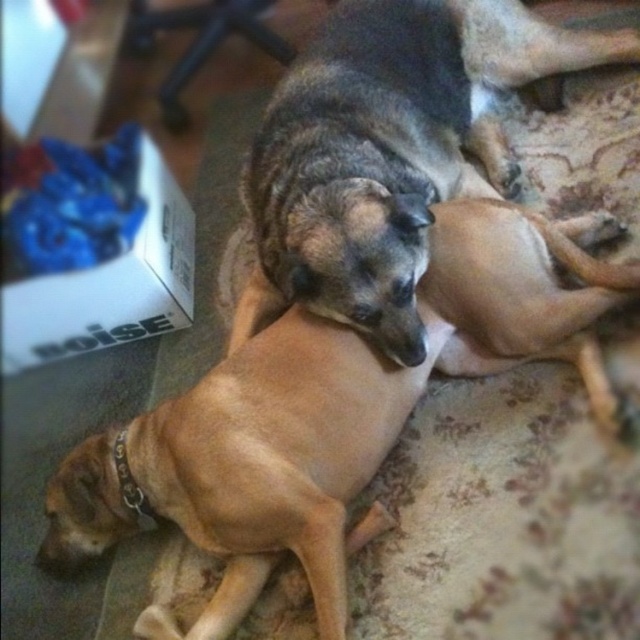
Question: Does brown smooth dog at lower left have a lesser width compared to brown fur dog at center?

Choices:
 (A) yes
 (B) no

Answer: (B)

Question: Is brown smooth dog at lower left positioned behind brown fur dog at center?

Choices:
 (A) no
 (B) yes

Answer: (A)

Question: Which object appears farthest from the camera in this image?

Choices:
 (A) brown fur dog at center
 (B) brown smooth dog at lower left

Answer: (A)

Question: Which point is closer to the camera?

Choices:
 (A) brown smooth dog at lower left
 (B) brown fur dog at center

Answer: (A)

Question: Is brown smooth dog at lower left bigger than brown fur dog at center?

Choices:
 (A) yes
 (B) no

Answer: (B)

Question: Which object appears closest to the camera in this image?

Choices:
 (A) brown fur dog at center
 (B) brown smooth dog at lower left

Answer: (B)